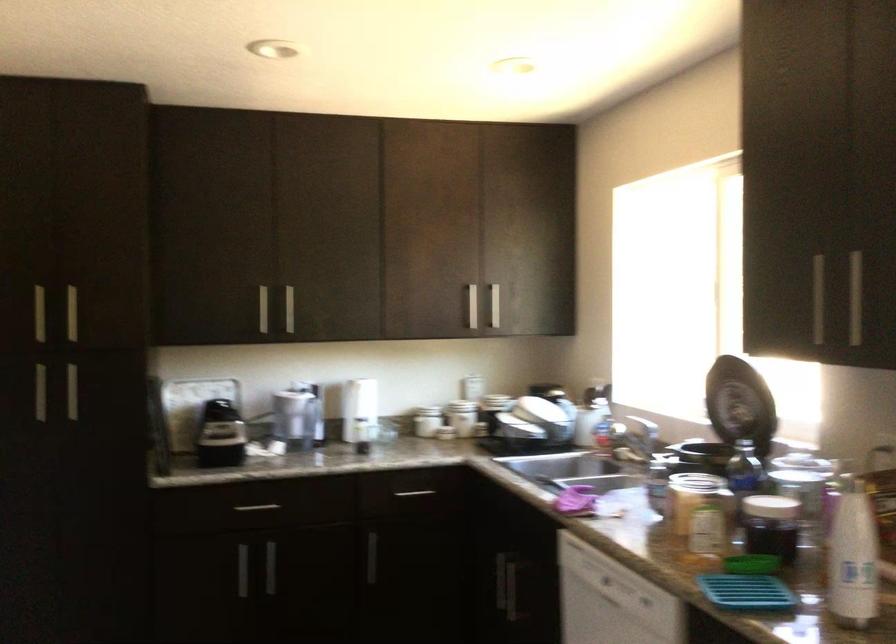
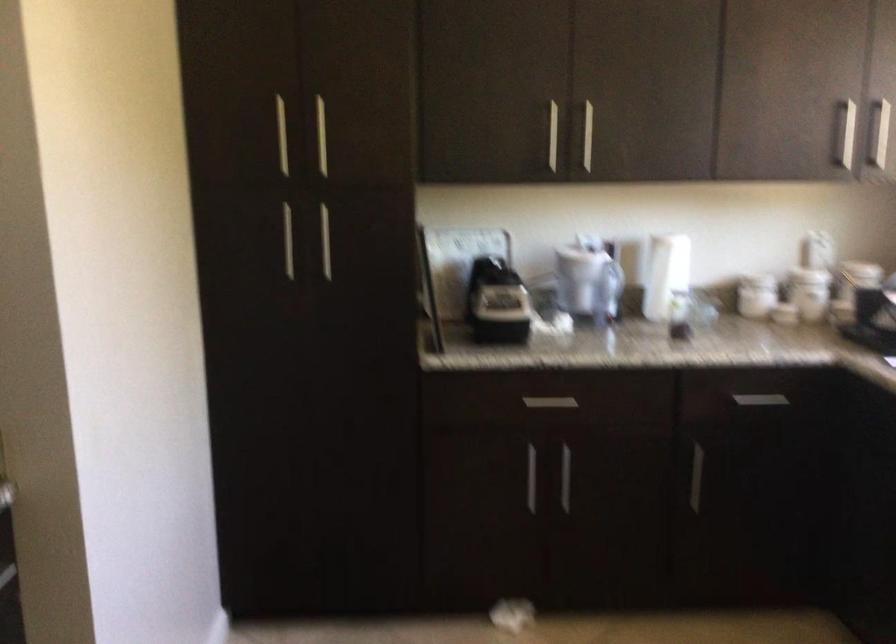
What movement of the cameraman would produce the second image?

The movement direction of the cameraman is left, forward.